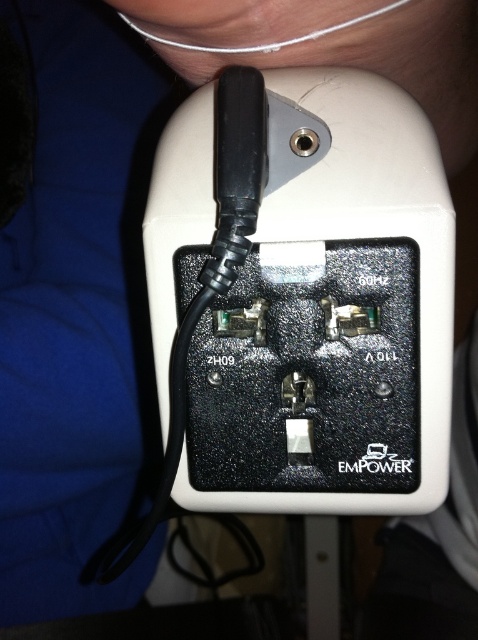
Question: Which of the following is the closest to the observer?

Choices:
 (A) white wire at upper center
 (B) black textured power outlet at center

Answer: (B)

Question: Does black textured power outlet at center appear under white wire at upper center?

Choices:
 (A) yes
 (B) no

Answer: (A)

Question: Is black textured power outlet at center smaller than white wire at upper center?

Choices:
 (A) no
 (B) yes

Answer: (A)

Question: Can you confirm if black textured power outlet at center is positioned below white wire at upper center?

Choices:
 (A) yes
 (B) no

Answer: (A)